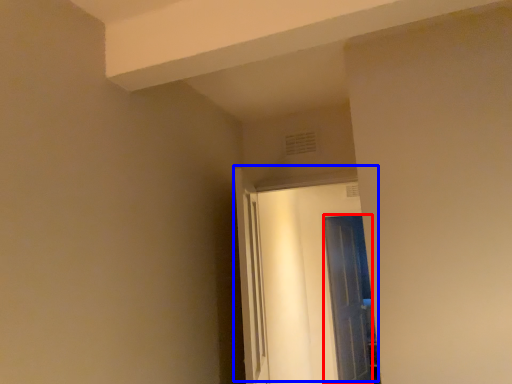
Question: Which object appears closest to the camera in this image, door (highlighted by a red box) or door (highlighted by a blue box)?

Choices:
 (A) door
 (B) door

Answer: (B)